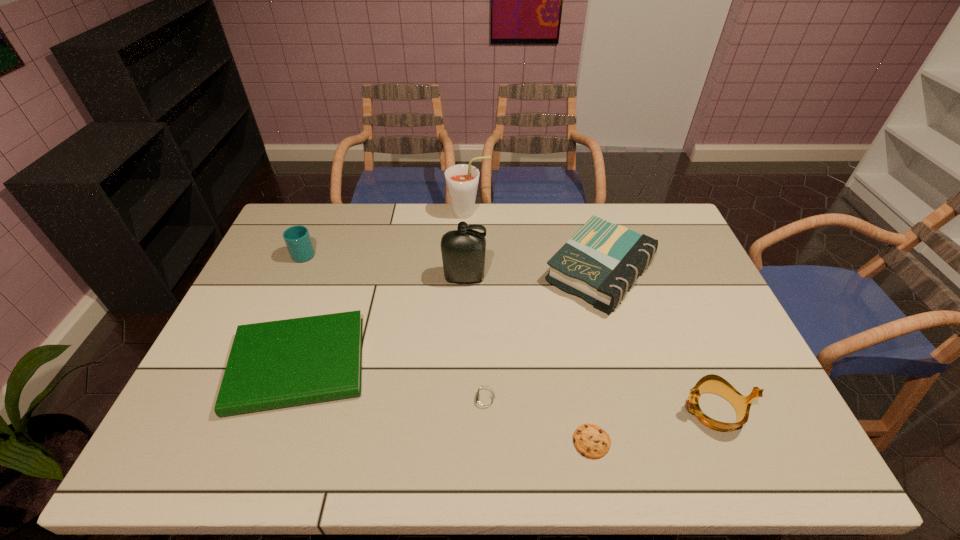
Image resolution: width=960 pixels, height=540 pixels. I want to click on free space located 0.290m on the face of the watch, so click(347, 400).

At what (x,y) coordinates should I click in order to perform the action: click on free space located on the face of the watch. Please return your answer as a coordinate pair (x, y). Looking at the image, I should click on (399, 400).

Where is `vacant space situated 0.380m on the face of the watch`? The height and width of the screenshot is (540, 960). vacant space situated 0.380m on the face of the watch is located at coordinates (311, 400).

Locate an element on the screen. vacant region located 0.070m on the left of the shortest object is located at coordinates (542, 442).

At what (x,y) coordinates should I click in order to perform the action: click on root beer located in the far edge section of the desktop. Please return your answer as a coordinate pair (x, y). Looking at the image, I should click on (462, 180).

The image size is (960, 540). I want to click on cup present at the far edge, so click(297, 238).

Find the location of a particular element. This screenshot has height=540, width=960. paperback book present at the far edge is located at coordinates (599, 263).

Locate an element on the screen. The image size is (960, 540). tiara present at the near edge is located at coordinates (711, 383).

What are the coordinates of `cookie present at the near edge` in the screenshot? It's located at (591, 441).

The image size is (960, 540). I want to click on cup at the left edge, so click(297, 238).